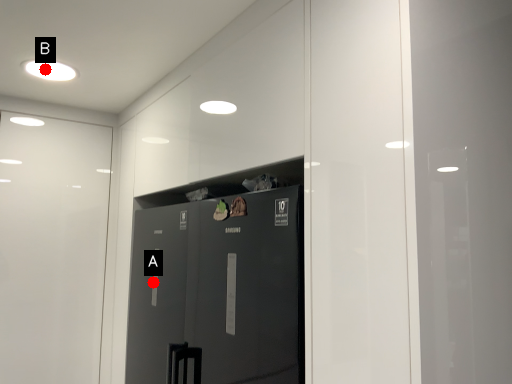
Question: Two points are circled on the image, labeled by A and B beside each circle. Which point appears farthest from the camera in this image?

Choices:
 (A) A is further
 (B) B is further

Answer: (A)